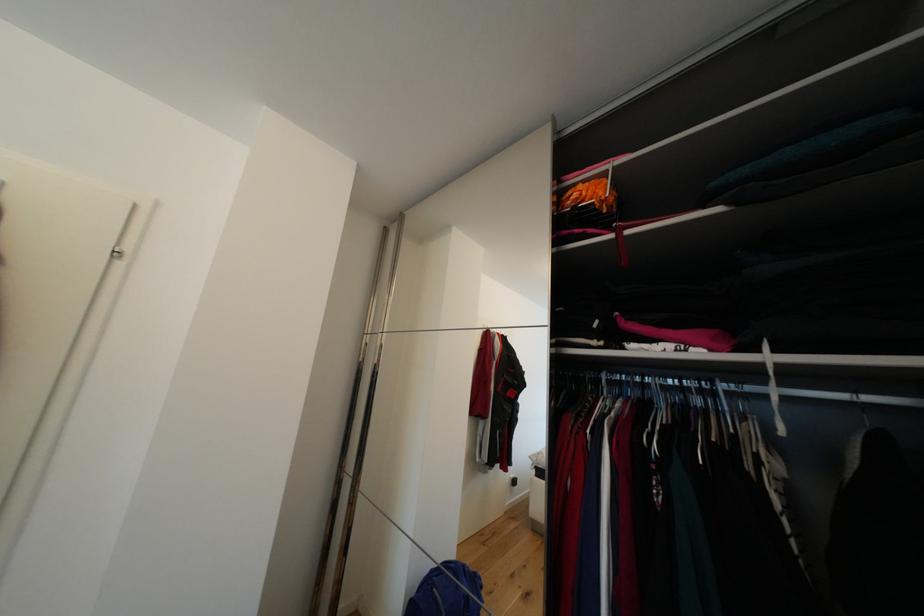
Where would you lift the pink wire basket? Please return your answer as a coordinate pair (x, y).

(587, 208)